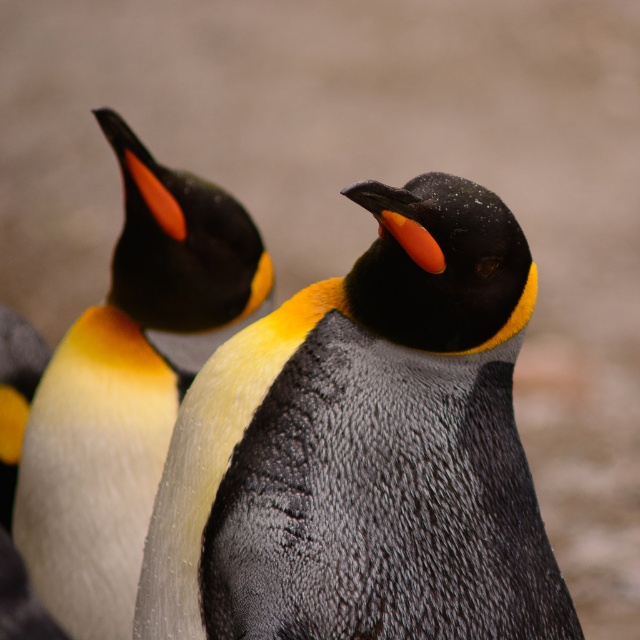
Based on the photo, you are a photographer trying to capture a close up of the matte black penguin at upper left. You have a camera with a zoom lens that can focus on a specific point. The focus point is currently set to coordinates point (129, 385). Is this point likely to be on the matte black penguin at upper left?

Yes, the point (129, 385) corresponds to the matte black penguin at upper left, so the focus point is correctly placed on it.

You are a wildlife photographer trying to capture a photo of both the textured gray penguin at center and the white fluffy penguin at left. Since you want to ensure both are in focus, you need to know which one is taller. Can you tell me which penguin is taller?

The textured gray penguin at center is much taller than the white fluffy penguin at left according to the description.